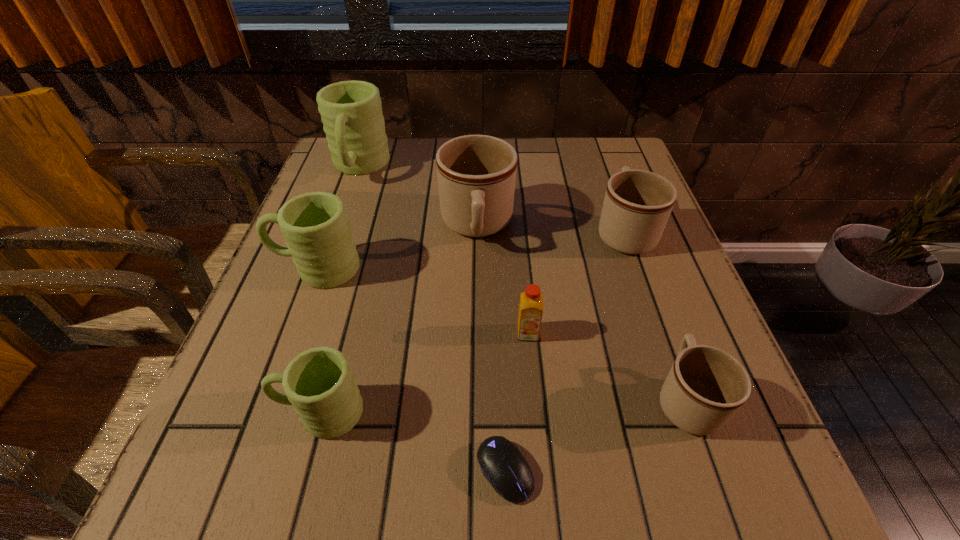
Locate an element on the screen. Image resolution: width=960 pixels, height=540 pixels. vacant area between the smallest green mug and the second biggest green mug is located at coordinates (319, 340).

Identify the location of unoccupied area between the smallest green mug and the second smallest brown mug. The width and height of the screenshot is (960, 540). (472, 322).

Locate an element on the screen. The height and width of the screenshot is (540, 960). free space between the second smallest brown mug and the nearest brown mug is located at coordinates (656, 315).

Locate an element on the screen. object that is the seventh closest one to the farthest mug is located at coordinates (706, 386).

Point out which object is positioned as the third nearest to the nearest green mug. Please provide its 2D coordinates. Your answer should be formatted as a tuple, i.e. [(x, y)], where the tuple contains the x and y coordinates of a point satisfying the conditions above.

[(531, 301)]

Locate which mug ranks fifth in proximity to the second nearest green mug. Please provide its 2D coordinates. Your answer should be formatted as a tuple, i.e. [(x, y)], where the tuple contains the x and y coordinates of a point satisfying the conditions above.

[(706, 386)]

Choose which mug is the nearest neighbor to the second smallest brown mug. Please provide its 2D coordinates. Your answer should be formatted as a tuple, i.e. [(x, y)], where the tuple contains the x and y coordinates of a point satisfying the conditions above.

[(476, 174)]

Locate which green mug is the second closest to the orange juice. Please provide its 2D coordinates. Your answer should be formatted as a tuple, i.e. [(x, y)], where the tuple contains the x and y coordinates of a point satisfying the conditions above.

[(315, 225)]

Identify which green mug is located as the third nearest to the computer mouse. Please provide its 2D coordinates. Your answer should be formatted as a tuple, i.e. [(x, y)], where the tuple contains the x and y coordinates of a point satisfying the conditions above.

[(351, 111)]

In order to click on brown mug that stands as the third closest to the nearest green mug in this screenshot , I will do `click(637, 205)`.